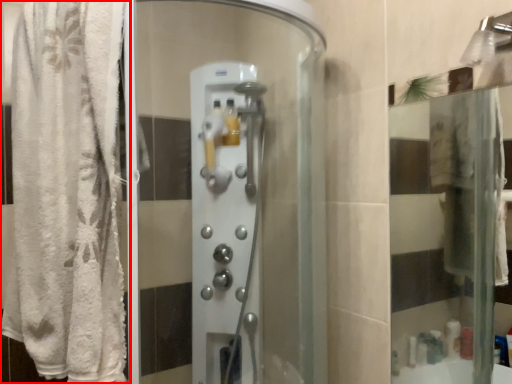
Question: From the image's perspective, where is curtain (annotated by the red box) located in relation to screen door in the image?

Choices:
 (A) above
 (B) below

Answer: (A)